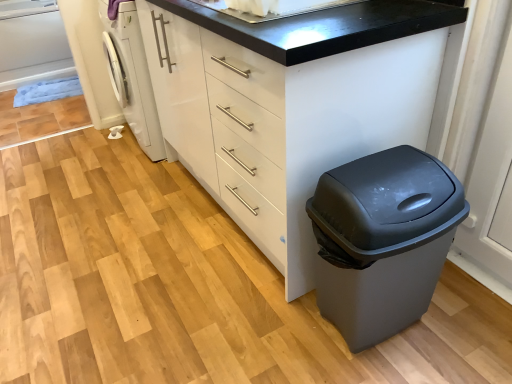
The height and width of the screenshot is (384, 512). What are the coordinates of `vacant space to the left of white matte chest of drawers at center` in the screenshot? It's located at (126, 242).